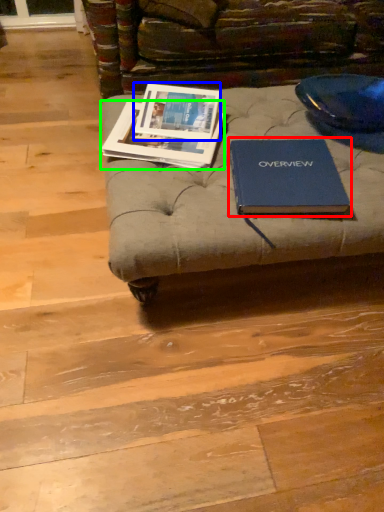
Question: Which is nearer to the book (highlighted by a red box)? book cover (highlighted by a blue box) or book (highlighted by a green box).

Choices:
 (A) book cover
 (B) book

Answer: (B)